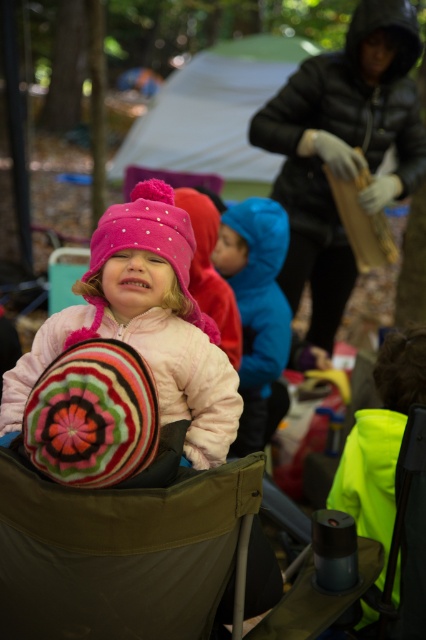
Question: Which of the following is the closest to the observer?

Choices:
 (A) green fabric folding chair at center
 (B) blue fuzzy jacket at center

Answer: (A)

Question: Which point appears farthest from the camera in this image?

Choices:
 (A) (253, 202)
 (B) (169, 509)
 (C) (143, 330)
 (D) (215, 144)

Answer: (D)

Question: Estimate the real-world distances between objects in this image. Which object is closer to the green fabric folding chair at center?

Choices:
 (A) white fabric tent at upper center
 (B) blue fuzzy jacket at center
 (C) pink fleece jacket at center

Answer: (C)

Question: Does pink fleece jacket at center have a smaller size compared to blue fuzzy jacket at center?

Choices:
 (A) yes
 (B) no

Answer: (A)

Question: Can you confirm if white fabric tent at upper center is positioned below blue fuzzy jacket at center?

Choices:
 (A) yes
 (B) no

Answer: (B)

Question: Is white fabric tent at upper center closer to camera compared to blue fuzzy jacket at center?

Choices:
 (A) no
 (B) yes

Answer: (A)